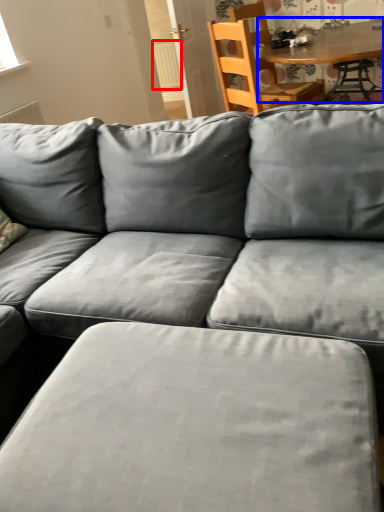
Question: Which of the following is the closest to the observer, radiator (highlighted by a red box) or table (highlighted by a blue box)?

Choices:
 (A) radiator
 (B) table

Answer: (B)